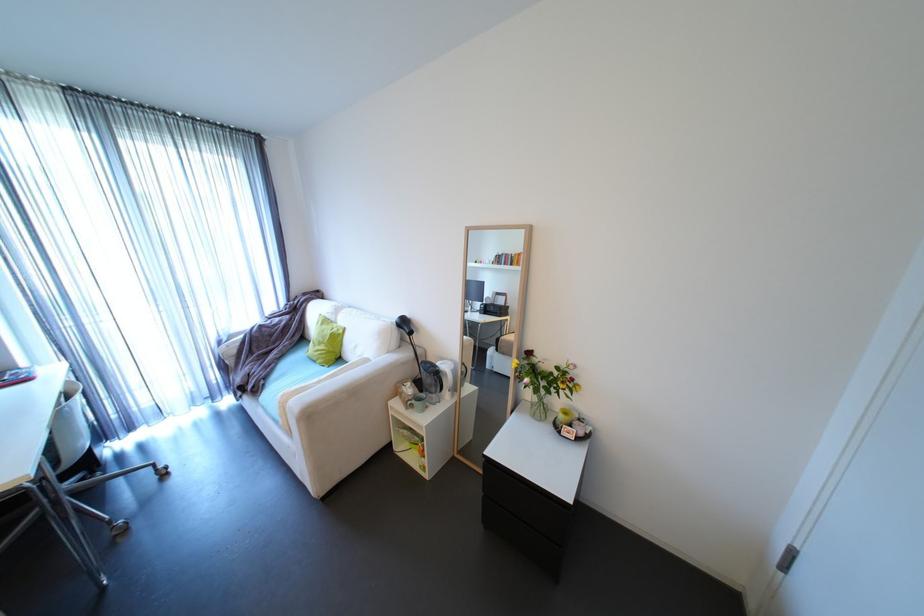
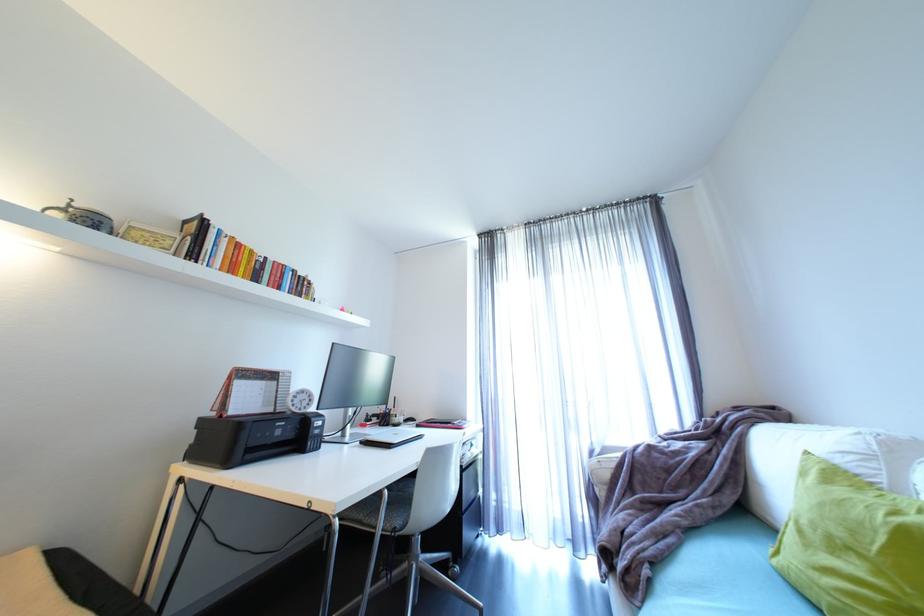
Where in the second image is the point corresponding to (x=35, y=485) from the first image?

(344, 522)